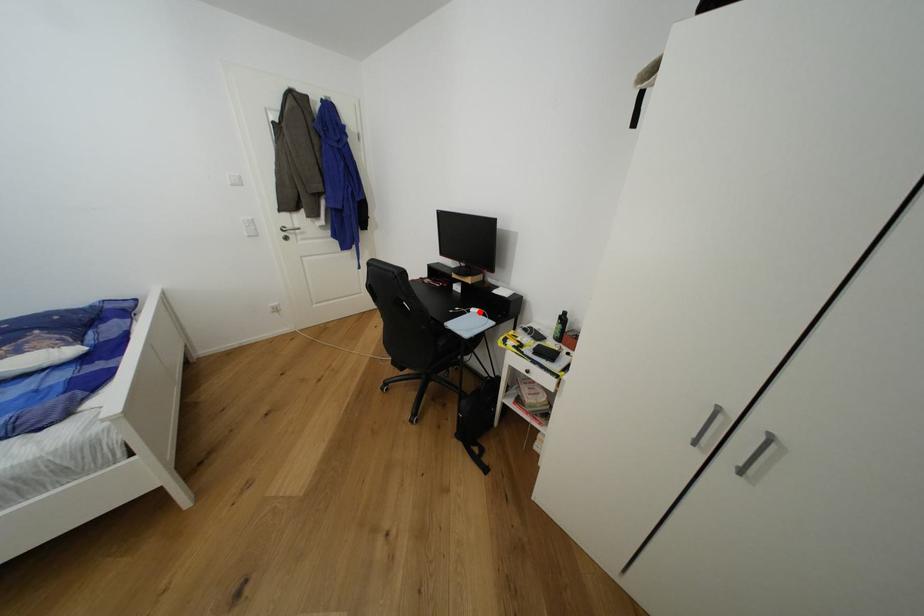
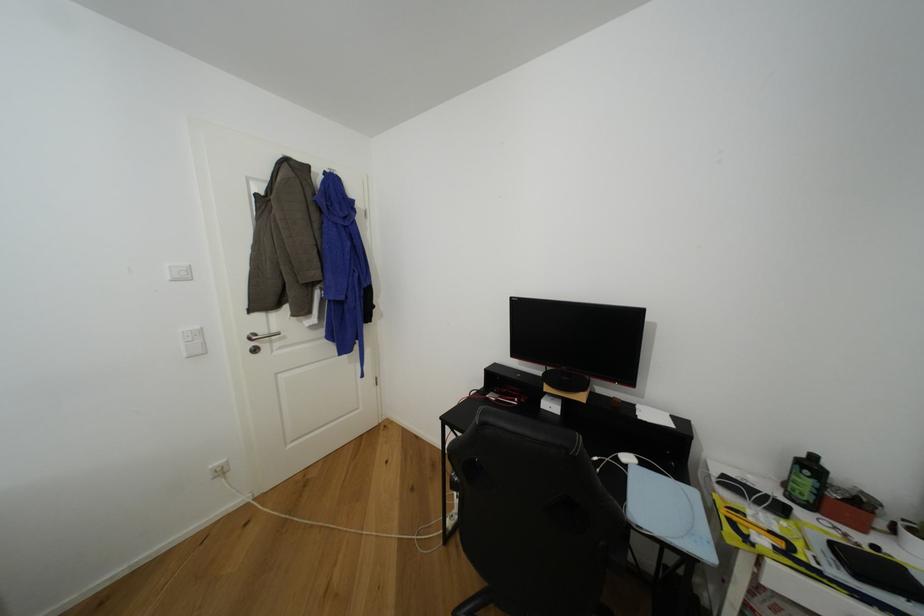
Find the pixel in the second image that matches the highlighted location in the first image.

(633, 460)